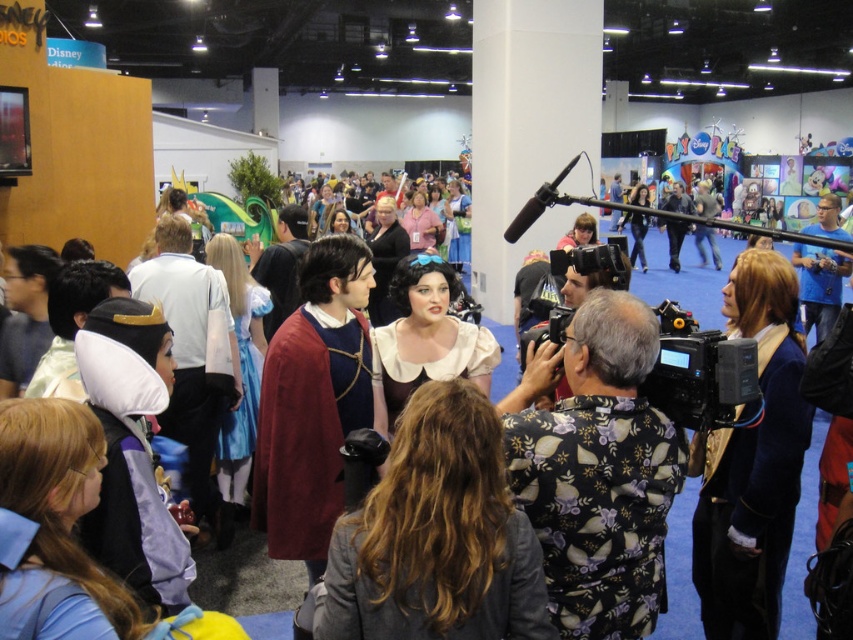
You are standing in the convention hall and want to take a photo of the point at coordinates (735, 605). If your camera has a maximum focus range of 10 feet, will it be able to focus on that point?

The distance of point (735, 605) from the viewer is 8.94 feet, which is within the camera maximum focus range of 10 feet. Therefore, the camera can focus on that point.

You are a photographer at the event and need to position yourself to capture both the blue velvet jacket at right and the smooth white wig at center in the same frame. Based on their positions, which object should you focus on first to ensure both are in view?

The blue velvet jacket at right is located below the smooth white wig at center, so you should focus on the smooth white wig at center first to ensure both are in view.